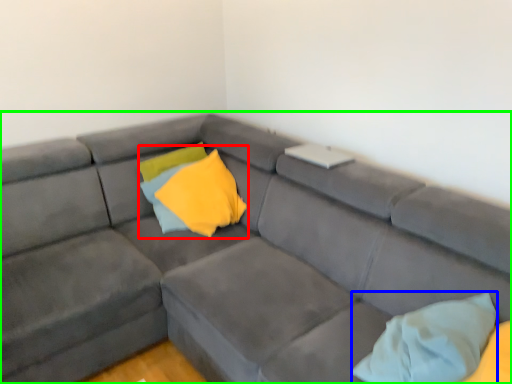
Question: Which object is the farthest from pillow (highlighted by a red box)? Choose among these: pillow (highlighted by a blue box) or studio couch (highlighted by a green box).

Choices:
 (A) pillow
 (B) studio couch

Answer: (A)